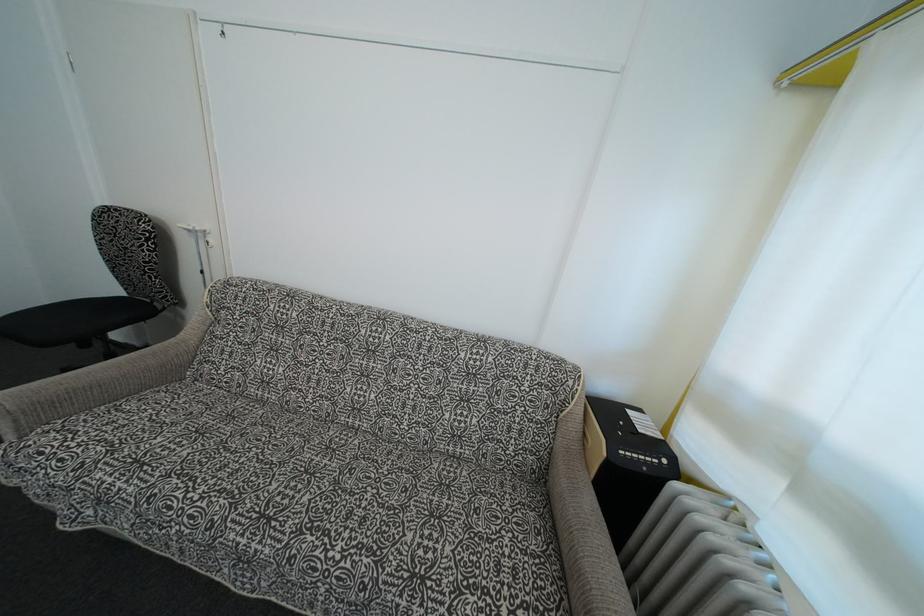
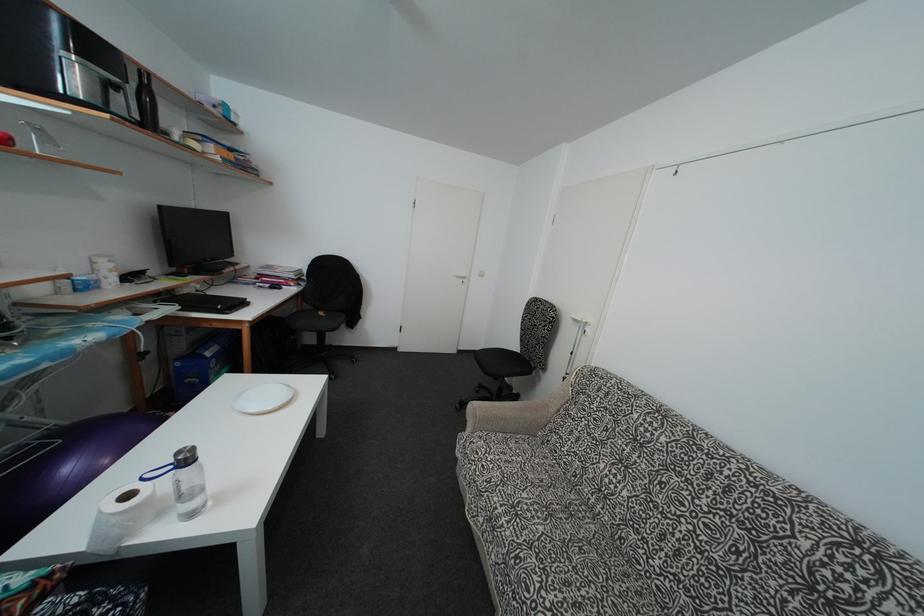
Locate, in the second image, the point that corresponds to point 116,296 in the first image.

(517, 353)